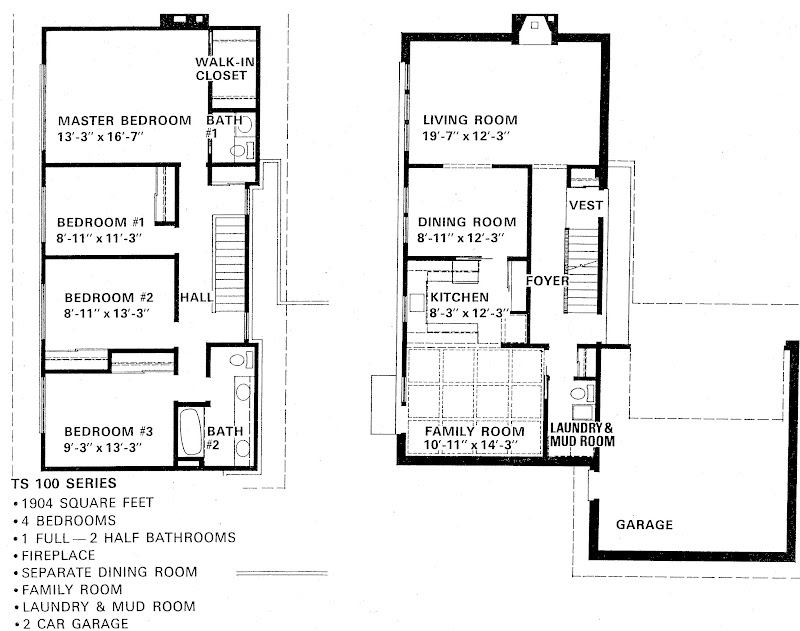
What are the coordinates of `kitchen` in the screenshot? It's located at (470, 298).